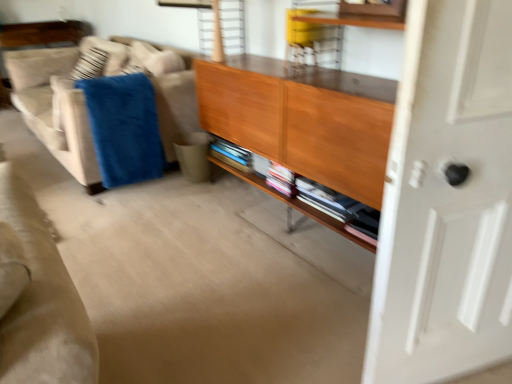
Question: From the image's perspective, is wooden shelf at center located above or below white glossy door at right?

Choices:
 (A) above
 (B) below

Answer: (A)

Question: In terms of size, does wooden shelf at center appear bigger or smaller than white glossy door at right?

Choices:
 (A) big
 (B) small

Answer: (B)

Question: Which object is the closest to the blue soft blanket at left?

Choices:
 (A) white glossy door at right
 (B) wooden cabinet at center
 (C) beige fabric couch at left
 (D) wooden shelf at center

Answer: (C)

Question: Which is nearer to the blue soft blanket at left?

Choices:
 (A) beige fabric couch at left
 (B) wooden shelf at center
 (C) white glossy door at right
 (D) wooden cabinet at center

Answer: (A)